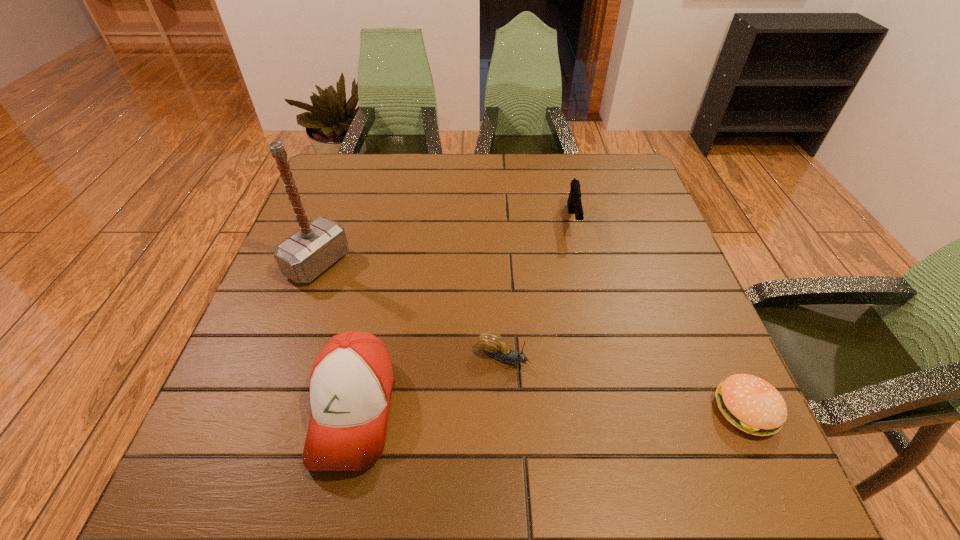
At what (x,y) coordinates should I click in order to perform the action: click on unoccupied position between the third shortest object and the rightmost object. Please return your answer as a coordinate pair (x, y). Image resolution: width=960 pixels, height=540 pixels. Looking at the image, I should click on (659, 315).

The height and width of the screenshot is (540, 960). In order to click on free point between the pistol and the rightmost object in this screenshot , I will do `click(659, 315)`.

Identify the location of free spot between the escargot and the third shortest object. (539, 288).

Find the location of `vacant point located between the second object from right to left and the fourth object from right to left`. vacant point located between the second object from right to left and the fourth object from right to left is located at coordinates [x=463, y=315].

This screenshot has height=540, width=960. I want to click on free area in between the rightmost object and the baseball cap, so click(x=549, y=410).

This screenshot has height=540, width=960. What are the coordinates of `free space that is in between the pistol and the third object from right to left` in the screenshot? It's located at coord(539,288).

Locate an element on the screen. The height and width of the screenshot is (540, 960). unoccupied area between the tallest object and the rightmost object is located at coordinates (532, 337).

The image size is (960, 540). What are the coordinates of `object that is the nearest to the baseball cap` in the screenshot? It's located at (491, 342).

Identify which object is the second nearest to the baseball cap. Please provide its 2D coordinates. Your answer should be formatted as a tuple, i.e. [(x, y)], where the tuple contains the x and y coordinates of a point satisfying the conditions above.

[(304, 255)]

Where is `vacant point that satisfies the following two spatial constraints: 1. on the front-facing side of the baseball cap; 2. on the right side of the rightmost object`? vacant point that satisfies the following two spatial constraints: 1. on the front-facing side of the baseball cap; 2. on the right side of the rightmost object is located at coordinates (352, 410).